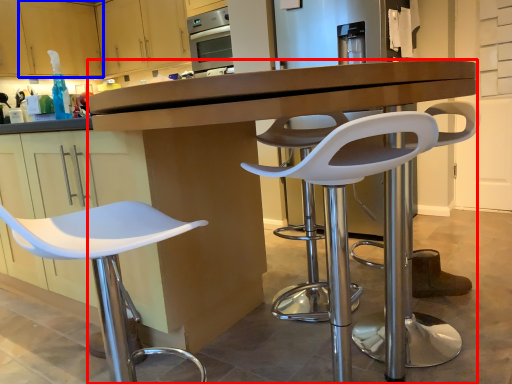
Question: Which point is closer to the camera, desk (highlighted by a red box) or cabinetry (highlighted by a blue box)?

Choices:
 (A) desk
 (B) cabinetry

Answer: (A)